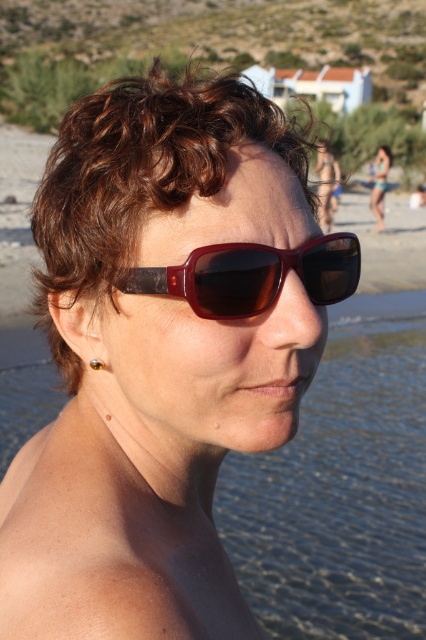
Which is more to the right, brown curly hair at center or matte brown sunglasses at center?

From the viewer's perspective, matte brown sunglasses at center appears more on the right side.

This screenshot has width=426, height=640. Find the location of `brown curly hair at center`. brown curly hair at center is located at coordinates (140, 177).

Is dry skin at lower left above shiny brown plastic goggles at center?

No, dry skin at lower left is not above shiny brown plastic goggles at center.

From the picture: Which is below, dry skin at lower left or shiny brown plastic goggles at center?

dry skin at lower left

Between point (167, 536) and point (241, 316), which one is positioned behind?

The point (167, 536) is behind.

Locate an element on the screen. dry skin at lower left is located at coordinates (114, 538).

How distant is brown curly hair at center from matte brown sunglasses at upper right?

A distance of 15.40 meters exists between brown curly hair at center and matte brown sunglasses at upper right.

Does brown curly hair at center have a greater width compared to matte brown sunglasses at upper right?

No, brown curly hair at center is not wider than matte brown sunglasses at upper right.

Between point (195, 163) and point (377, 195), which one is positioned behind?

Point (377, 195)

This screenshot has width=426, height=640. I want to click on brown curly hair at center, so click(x=140, y=177).